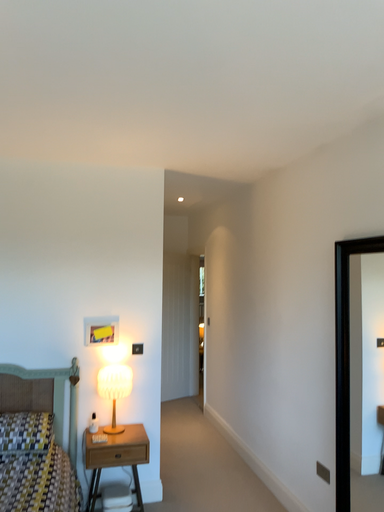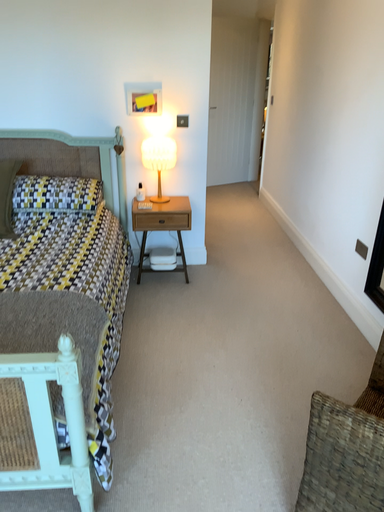
Question: How did the camera likely rotate when shooting the video?

Choices:
 (A) rotated downward
 (B) rotated upward

Answer: (A)